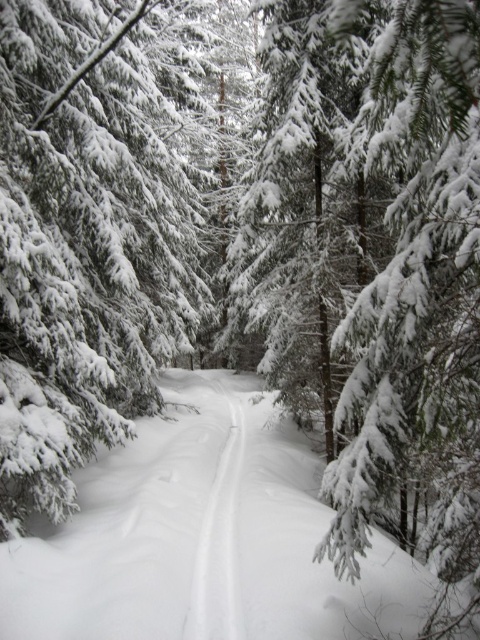
Question: Is green textured pine tree at center above white fluffy snow at center?

Choices:
 (A) yes
 (B) no

Answer: (A)

Question: Which object is closer to the camera taking this photo?

Choices:
 (A) white snow trail at center
 (B) white fluffy snow at center
 (C) green textured pine tree at center

Answer: (B)

Question: Among these points, which one is farthest from the camera?

Choices:
 (A) (29, 556)
 (B) (187, 625)

Answer: (A)

Question: From the image, what is the correct spatial relationship of green textured pine tree at center in relation to white snow trail at center?

Choices:
 (A) right
 (B) left

Answer: (B)

Question: Which is nearer to the white snow trail at center?

Choices:
 (A) green textured pine tree at center
 (B) white fluffy snow at center

Answer: (B)

Question: Does green textured pine tree at center have a greater width compared to white snow trail at center?

Choices:
 (A) no
 (B) yes

Answer: (B)